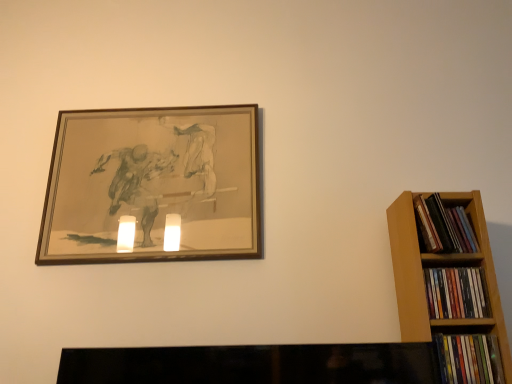
Question: Should I look upward or downward to see wooden picture frame at upper left?

Choices:
 (A) down
 (B) up

Answer: (B)

Question: Does multicolored paperbacks at right, placed as the first book when sorted from top to bottom, have a smaller size compared to multicolored paperbacks at right, the second book in the bottom-to-top sequence?

Choices:
 (A) no
 (B) yes

Answer: (B)

Question: Is multicolored paperbacks at right, arranged as the second book when viewed from the top, inside multicolored paperbacks at right, the third book ordered from the bottom?

Choices:
 (A) yes
 (B) no

Answer: (B)

Question: Does multicolored paperbacks at right, the third book ordered from the bottom, come in front of multicolored paperbacks at right, the second book in the bottom-to-top sequence?

Choices:
 (A) yes
 (B) no

Answer: (B)

Question: From a real-world perspective, is multicolored paperbacks at right, the third book ordered from the bottom, under multicolored paperbacks at right, arranged as the second book when viewed from the top?

Choices:
 (A) no
 (B) yes

Answer: (A)

Question: Is multicolored paperbacks at right, placed as the first book when sorted from top to bottom, at the right side of multicolored paperbacks at right, the second book in the bottom-to-top sequence?

Choices:
 (A) yes
 (B) no

Answer: (A)

Question: Can you confirm if multicolored paperbacks at right, placed as the first book when sorted from top to bottom, is wider than multicolored paperbacks at right, the second book in the bottom-to-top sequence?

Choices:
 (A) yes
 (B) no

Answer: (A)

Question: Does multicolored plastic books at right, which is the third book in top-to-bottom order, turn towards multicolored paperbacks at right, the third book ordered from the bottom?

Choices:
 (A) yes
 (B) no

Answer: (B)

Question: Is multicolored plastic books at right, placed as the 1th book when sorted from bottom to top, in front of multicolored paperbacks at right, placed as the first book when sorted from top to bottom?

Choices:
 (A) no
 (B) yes

Answer: (B)

Question: Is multicolored plastic books at right, which is the third book in top-to-bottom order, at the right side of multicolored paperbacks at right, the third book ordered from the bottom?

Choices:
 (A) no
 (B) yes

Answer: (A)

Question: Is multicolored plastic books at right, which is the third book in top-to-bottom order, at the left side of multicolored paperbacks at right, placed as the first book when sorted from top to bottom?

Choices:
 (A) yes
 (B) no

Answer: (A)

Question: Is multicolored plastic books at right, placed as the 1th book when sorted from bottom to top, surrounding multicolored paperbacks at right, the third book ordered from the bottom?

Choices:
 (A) yes
 (B) no

Answer: (B)

Question: Considering the relative sizes of multicolored plastic books at right, placed as the 1th book when sorted from bottom to top, and multicolored paperbacks at right, the third book ordered from the bottom, in the image provided, is multicolored plastic books at right, placed as the 1th book when sorted from bottom to top, shorter than multicolored paperbacks at right, the third book ordered from the bottom,?

Choices:
 (A) yes
 (B) no

Answer: (A)

Question: Is multicolored paperbacks at right, arranged as the second book when viewed from the top, at the right side of wooden picture frame at upper left?

Choices:
 (A) yes
 (B) no

Answer: (A)